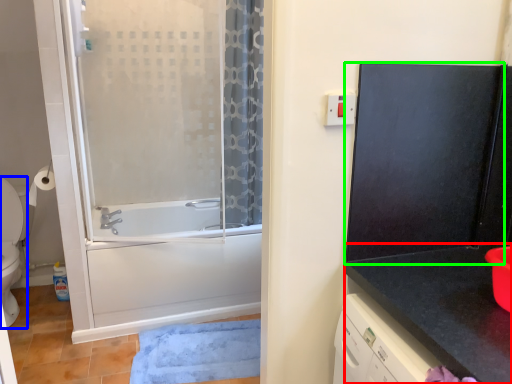
Question: Estimate the real-world distances between objects in this image. Which object is closer to counter top (highlighted by a red box), toilet (highlighted by a blue box) or screen door (highlighted by a green box)?

Choices:
 (A) toilet
 (B) screen door

Answer: (B)